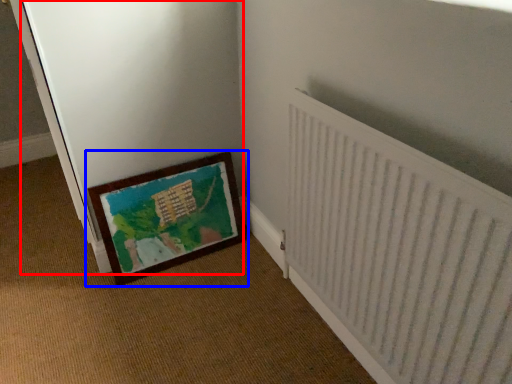
Question: Which point is closer to the camera, screen door (highlighted by a red box) or picture frame (highlighted by a blue box)?

Choices:
 (A) screen door
 (B) picture frame

Answer: (A)